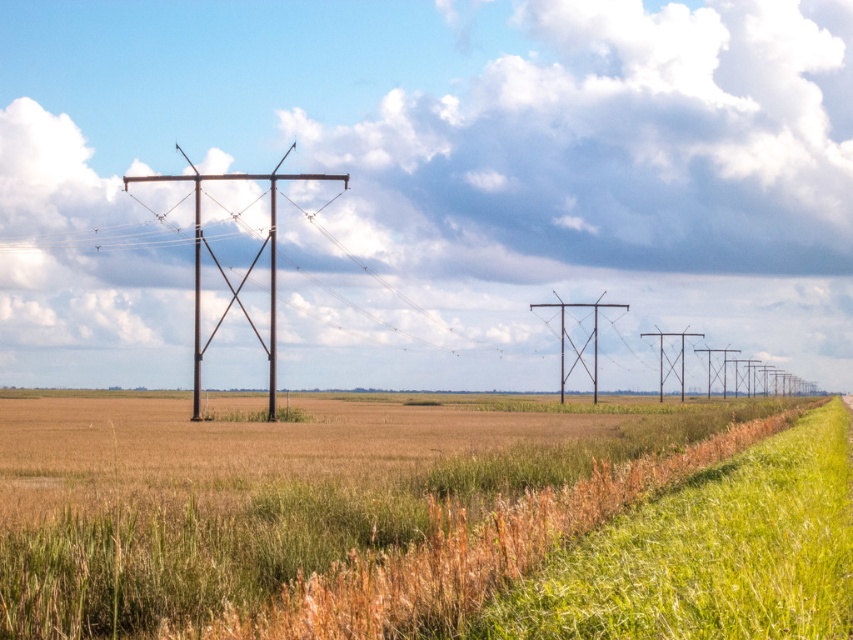
Does rusty metal telegraph pole at left have a lesser width compared to rusty metal telegraph pole at center?

In fact, rusty metal telegraph pole at left might be wider than rusty metal telegraph pole at center.

Does rusty metal telegraph pole at left lie behind rusty metal telegraph pole at center?

No, rusty metal telegraph pole at left is closer to the viewer.

Does point (199, 310) come behind point (560, 380)?

No, it is in front of (560, 380).

The image size is (853, 640). I want to click on rusty metal telegraph pole at left, so click(247, 269).

Which is more to the right, brown grassy wheat field at center or rusty metal telegraph pole at left?

brown grassy wheat field at center is more to the right.

Locate an element on the screen. The image size is (853, 640). brown grassy wheat field at center is located at coordinates (271, 497).

This screenshot has height=640, width=853. Find the location of `brown grassy wheat field at center`. brown grassy wheat field at center is located at coordinates (271, 497).

Is brown grassy wheat field at center below rusty metal telegraph pole at center?

Correct, brown grassy wheat field at center is located below rusty metal telegraph pole at center.

Where is `brown grassy wheat field at center`? This screenshot has width=853, height=640. brown grassy wheat field at center is located at coordinates (271, 497).